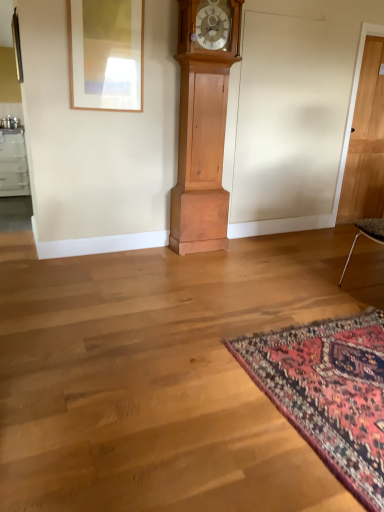
Question: Can you confirm if light brown wood grandfather clock at center is shorter than matte wooden picture frame at upper left?

Choices:
 (A) yes
 (B) no

Answer: (B)

Question: From a real-world perspective, is light brown wood grandfather clock at center located beneath matte wooden picture frame at upper left?

Choices:
 (A) yes
 (B) no

Answer: (A)

Question: Is light brown wood grandfather clock at center placed right next to matte wooden picture frame at upper left?

Choices:
 (A) no
 (B) yes

Answer: (A)

Question: Is light brown wood grandfather clock at center wider than matte wooden picture frame at upper left?

Choices:
 (A) no
 (B) yes

Answer: (B)

Question: Is light brown wood grandfather clock at center in front of matte wooden picture frame at upper left?

Choices:
 (A) no
 (B) yes

Answer: (A)

Question: Which is correct: light brown wooden door at right is inside matte wooden picture frame at upper left, or outside of it?

Choices:
 (A) inside
 (B) outside

Answer: (B)

Question: Is light brown wooden door at right wider or thinner than matte wooden picture frame at upper left?

Choices:
 (A) thin
 (B) wide

Answer: (B)

Question: Considering their positions, is light brown wooden door at right located in front of or behind matte wooden picture frame at upper left?

Choices:
 (A) front
 (B) behind

Answer: (B)

Question: In terms of height, does light brown wooden door at right look taller or shorter compared to matte wooden picture frame at upper left?

Choices:
 (A) tall
 (B) short

Answer: (A)

Question: From a real-world perspective, is carpet with intricate patterns at lower right positioned above or below light brown wooden door at right?

Choices:
 (A) below
 (B) above

Answer: (A)

Question: Considering the positions of carpet with intricate patterns at lower right and light brown wooden door at right in the image, is carpet with intricate patterns at lower right bigger or smaller than light brown wooden door at right?

Choices:
 (A) small
 (B) big

Answer: (A)

Question: Considering the relative positions of carpet with intricate patterns at lower right and light brown wooden door at right in the image provided, is carpet with intricate patterns at lower right to the left or to the right of light brown wooden door at right?

Choices:
 (A) left
 (B) right

Answer: (A)

Question: In the image, is carpet with intricate patterns at lower right positioned in front of or behind light brown wooden door at right?

Choices:
 (A) behind
 (B) front

Answer: (B)

Question: Considering the positions of light brown wood grandfather clock at center and matte wooden picture frame at upper left in the image, is light brown wood grandfather clock at center taller or shorter than matte wooden picture frame at upper left?

Choices:
 (A) short
 (B) tall

Answer: (B)

Question: Is point (183, 167) positioned closer to the camera than point (99, 74)?

Choices:
 (A) closer
 (B) farther

Answer: (B)